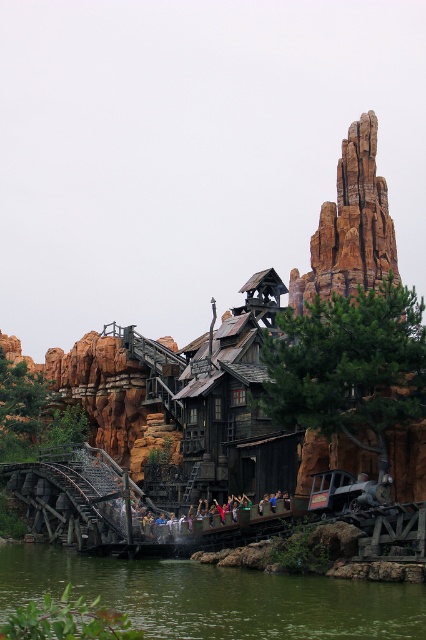
Does wooden roller coaster at center appear under green water at lower center?

No, wooden roller coaster at center is not below green water at lower center.

Is wooden roller coaster at center further to the viewer compared to green water at lower center?

Yes, wooden roller coaster at center is behind green water at lower center.

Does point (357, 180) come in front of point (268, 602)?

No, it is not.

I want to click on wooden roller coaster at center, so (213, 412).

Who is more distant from viewer, (210, 381) or (342, 164)?

Point (342, 164)

From the picture: Is wooden roller coaster at center thinner than rustic stone rock formation at upper right?

In fact, wooden roller coaster at center might be wider than rustic stone rock formation at upper right.

Is point (66, 541) farther from camera compared to point (322, 257)?

No, (66, 541) is closer to viewer.

I want to click on wooden roller coaster at center, so click(213, 412).

Between point (247, 349) and point (129, 516), which one is positioned in front?

Point (129, 516) is more forward.

Is wooden roller coaster at center bigger than multicolored fabric boat at center?

Yes.

Locate an element on the screen. The image size is (426, 640). wooden roller coaster at center is located at coordinates (213, 412).

Identify the location of wooden roller coaster at center. The width and height of the screenshot is (426, 640). (213, 412).